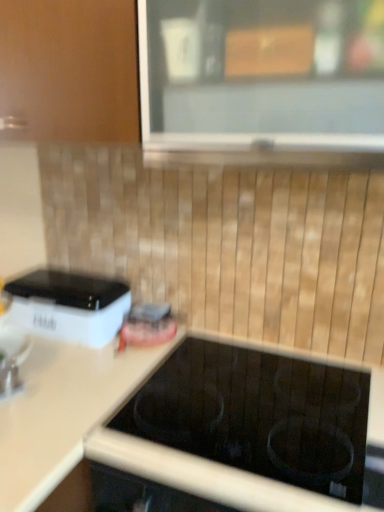
Image resolution: width=384 pixels, height=512 pixels. In order to click on empty space that is ontop of white matte countertop at center (from a real-world perspective) in this screenshot , I will do `click(178, 388)`.